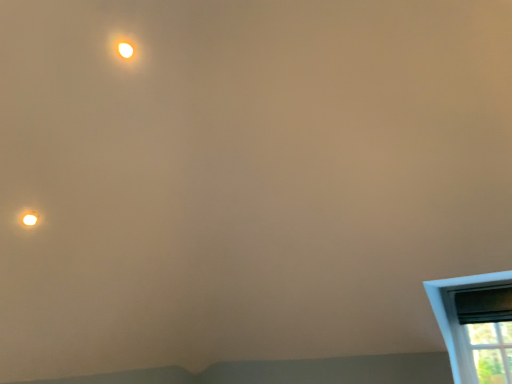
Question: From the image's perspective, relative to matte white light at upper left, is black plastic window screen at lower right above or below?

Choices:
 (A) above
 (B) below

Answer: (B)

Question: Is black plastic window screen at lower right taller or shorter than matte white light at upper left?

Choices:
 (A) tall
 (B) short

Answer: (A)

Question: Considering the real-world distances, which object is closest to the matte white light at upper left?

Choices:
 (A) matte white droplight at upper left
 (B) black plastic window screen at lower right

Answer: (A)

Question: Considering the real-world distances, which object is farthest from the matte white droplight at upper left?

Choices:
 (A) matte white light at upper left
 (B) black plastic window screen at lower right

Answer: (B)